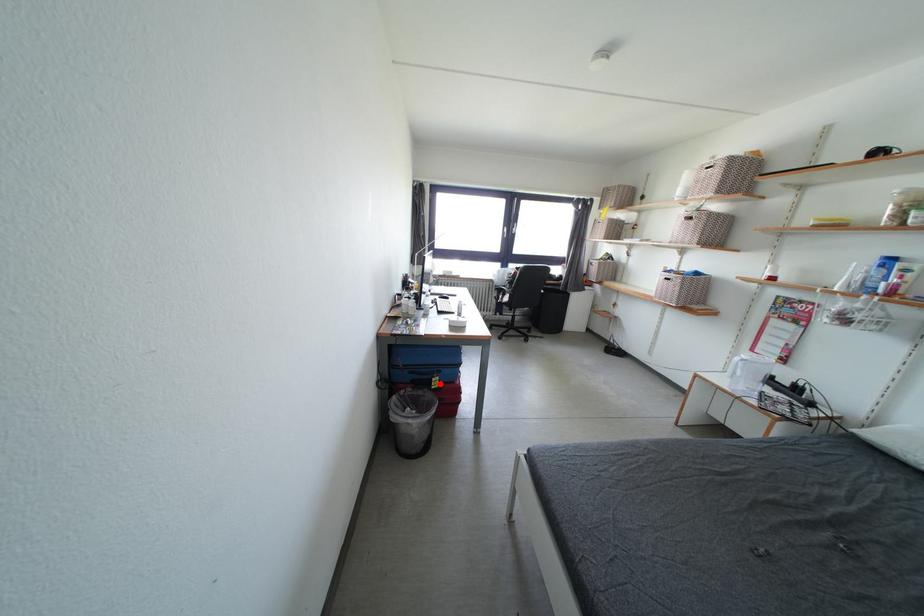
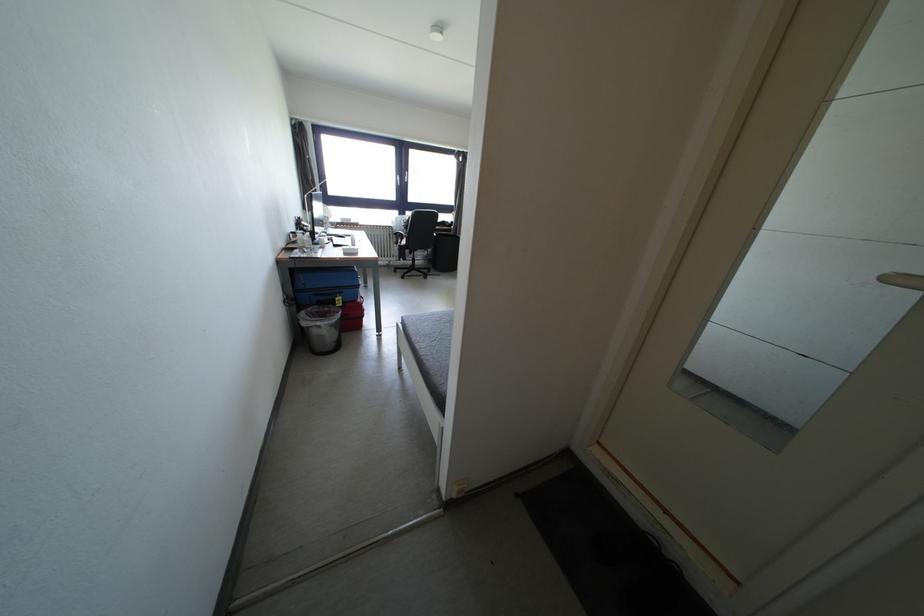
Question: I am providing you with two images of the same scene from different viewpoints. A red point is marked on the first image. Can you still see the location of the red point in image 2?

Choices:
 (A) Yes
 (B) No

Answer: (A)